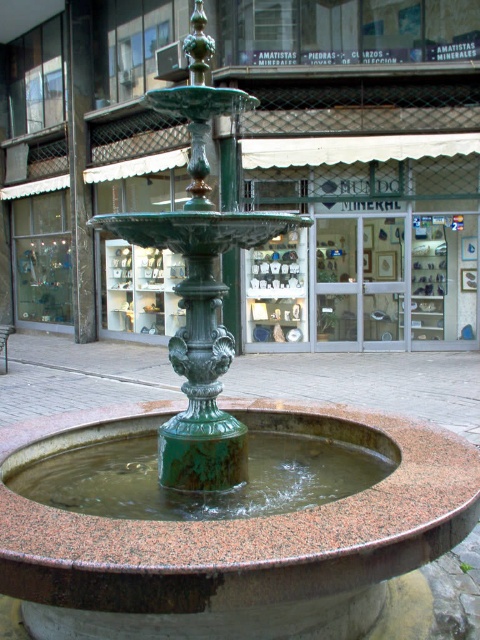
Question: Observing the image, what is the correct spatial positioning of green glazed fountain at center in reference to green patina fountain at center?

Choices:
 (A) right
 (B) left

Answer: (A)

Question: Which of the following is the closest to the observer?

Choices:
 (A) (371, 611)
 (B) (130, 497)

Answer: (A)

Question: Is green glazed fountain at center positioned in front of green patina fountain at center?

Choices:
 (A) no
 (B) yes

Answer: (B)

Question: Is the position of green glazed fountain at center less distant than that of green patina fountain at center?

Choices:
 (A) yes
 (B) no

Answer: (A)

Question: Which object appears farthest from the camera in this image?

Choices:
 (A) green glazed fountain at center
 (B) green patina fountain at center

Answer: (B)

Question: Which of the following is the closest to the observer?

Choices:
 (A) green patina fountain at center
 (B) green glazed fountain at center

Answer: (B)